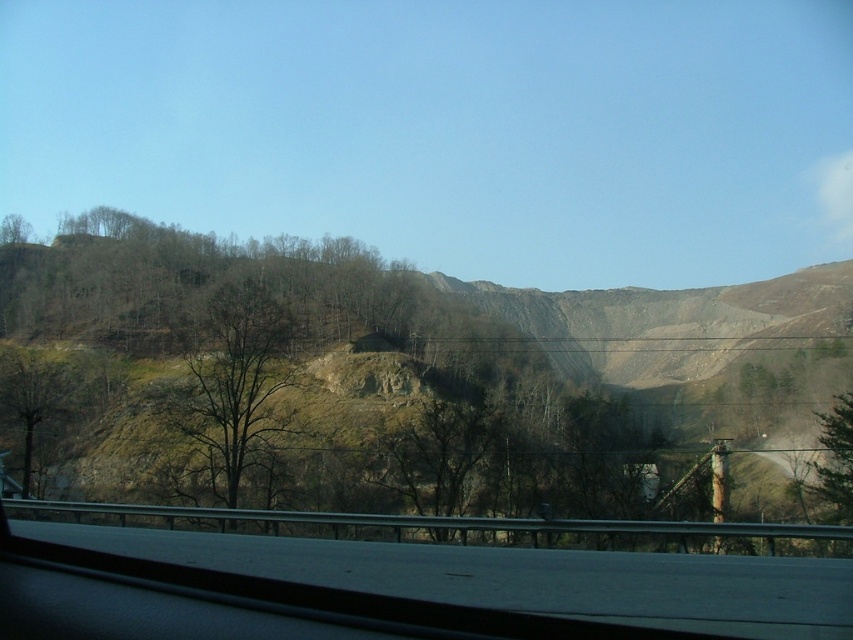
Does green leafy tree at center lie in front of green leafy tree at upper left?

Yes, green leafy tree at center is in front of green leafy tree at upper left.

Locate an element on the screen. green leafy tree at center is located at coordinates (235, 384).

Identify the location of green leafy tree at center. This screenshot has width=853, height=640. (235, 384).

Which is more to the left, green leafy tree at center or green leafy tree at lower left?

green leafy tree at lower left

Locate an element on the screen. The image size is (853, 640). green leafy tree at center is located at coordinates (235, 384).

Where is `green leafy tree at center`? This screenshot has width=853, height=640. green leafy tree at center is located at coordinates (235, 384).

At what (x,y) coordinates should I click in order to perform the action: click on green leafy tree at center. Please return your answer as a coordinate pair (x, y). The width and height of the screenshot is (853, 640). Looking at the image, I should click on (235, 384).

Where is `green leafy tree at lower left`? green leafy tree at lower left is located at coordinates (33, 397).

Between point (21, 490) and point (6, 240), which one is positioned in front?

Point (21, 490) is in front.

Image resolution: width=853 pixels, height=640 pixels. I want to click on green leafy tree at lower left, so click(x=33, y=397).